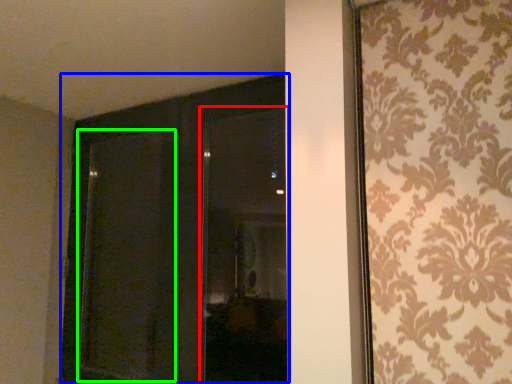
Question: Based on their relative distances, which object is farther from window (highlighted by a red box)? Choose from door (highlighted by a blue box) and screen door (highlighted by a green box).

Choices:
 (A) door
 (B) screen door

Answer: (B)